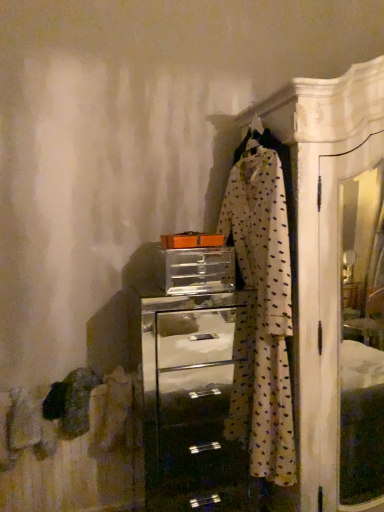
Question: From a real-world perspective, is metallic silver chest of drawers at center located higher than white dotted fabric at center?

Choices:
 (A) yes
 (B) no

Answer: (B)

Question: Is metallic silver chest of drawers at center completely or partially outside of white dotted fabric at center?

Choices:
 (A) no
 (B) yes

Answer: (B)

Question: Does metallic silver chest of drawers at center turn towards white dotted fabric at center?

Choices:
 (A) no
 (B) yes

Answer: (A)

Question: Can you confirm if metallic silver chest of drawers at center is thinner than white dotted fabric at center?

Choices:
 (A) yes
 (B) no

Answer: (B)

Question: From the image's perspective, is metallic silver chest of drawers at center beneath white dotted fabric at center?

Choices:
 (A) no
 (B) yes

Answer: (B)

Question: Is clear plastic drawer at center wider or thinner than white dotted fabric at center?

Choices:
 (A) thin
 (B) wide

Answer: (B)

Question: Considering the relative positions of clear plastic drawer at center and white dotted fabric at center in the image provided, is clear plastic drawer at center to the left or to the right of white dotted fabric at center?

Choices:
 (A) left
 (B) right

Answer: (A)

Question: From the image's perspective, is clear plastic drawer at center positioned above or below white dotted fabric at center?

Choices:
 (A) above
 (B) below

Answer: (A)

Question: Looking at the image, does clear plastic drawer at center seem bigger or smaller compared to white dotted fabric at center?

Choices:
 (A) big
 (B) small

Answer: (B)

Question: Considering the relative positions of clear plastic drawer at center and metallic silver chest of drawers at center in the image provided, is clear plastic drawer at center to the left or to the right of metallic silver chest of drawers at center?

Choices:
 (A) left
 (B) right

Answer: (A)

Question: Considering their positions, is clear plastic drawer at center located in front of or behind metallic silver chest of drawers at center?

Choices:
 (A) front
 (B) behind

Answer: (B)

Question: From their relative heights in the image, would you say clear plastic drawer at center is taller or shorter than metallic silver chest of drawers at center?

Choices:
 (A) tall
 (B) short

Answer: (B)

Question: From the image's perspective, is clear plastic drawer at center positioned above or below metallic silver chest of drawers at center?

Choices:
 (A) below
 (B) above

Answer: (B)

Question: From the image's perspective, is metallic silver chest of drawers at center located above or below white dotted fabric at center?

Choices:
 (A) below
 (B) above

Answer: (A)

Question: From their relative heights in the image, would you say metallic silver chest of drawers at center is taller or shorter than white dotted fabric at center?

Choices:
 (A) tall
 (B) short

Answer: (B)